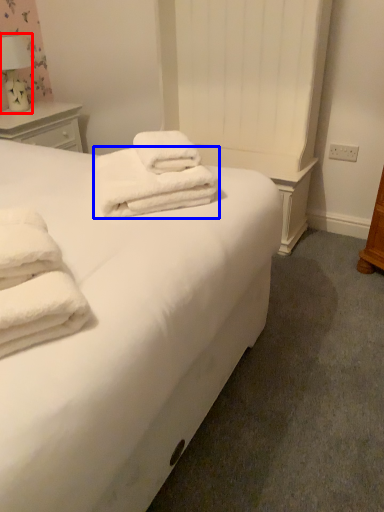
Question: Which object appears farthest to the camera in this image, table lamp (highlighted by a red box) or towel (highlighted by a blue box)?

Choices:
 (A) table lamp
 (B) towel

Answer: (A)